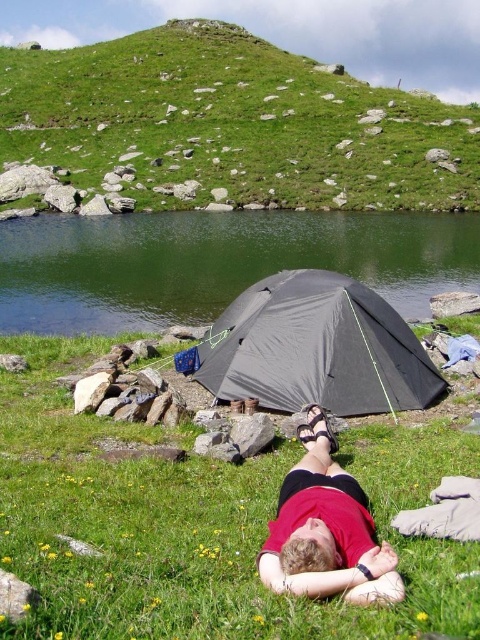
Who is taller, green smooth water at center or matte red shirt at lower center?

With more height is green smooth water at center.

Describe the element at coordinates (216, 262) in the screenshot. I see `green smooth water at center` at that location.

Is point (460, 253) positioned in front of point (321, 476)?

No, it is behind (321, 476).

The height and width of the screenshot is (640, 480). In order to click on green smooth water at center in this screenshot , I will do (x=216, y=262).

Consider the image. Can you confirm if green grass at center is positioned above dark gray fabric tent at center?

No.

In the scene shown: Is green grass at center bigger than dark gray fabric tent at center?

Yes, green grass at center is bigger than dark gray fabric tent at center.

At what (x,y) coordinates should I click in order to perform the action: click on green grass at center. Please return your answer as a coordinate pair (x, y). Looking at the image, I should click on (199, 522).

Find the location of a particular element. green grass at center is located at coordinates (199, 522).

Who is shorter, green grass at upper center or matte red shirt at lower center?

Standing shorter between the two is matte red shirt at lower center.

Consider the image. Is green grass at upper center positioned before matte red shirt at lower center?

No, it is behind matte red shirt at lower center.

Which is in front, point (365, 120) or point (302, 586)?

Positioned in front is point (302, 586).

Locate an element on the screen. This screenshot has width=480, height=640. green grass at upper center is located at coordinates (231, 124).